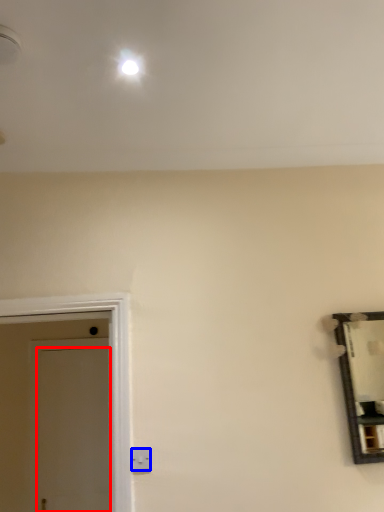
Question: Among these objects, which one is nearest to the camera, door (highlighted by a red box) or electric outlet (highlighted by a blue box)?

Choices:
 (A) door
 (B) electric outlet

Answer: (B)